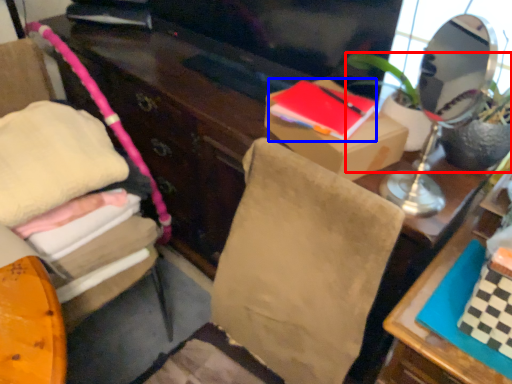
Question: Which of the following is the closest to the observer, houseplant (highlighted by a red box) or book (highlighted by a blue box)?

Choices:
 (A) houseplant
 (B) book

Answer: (A)